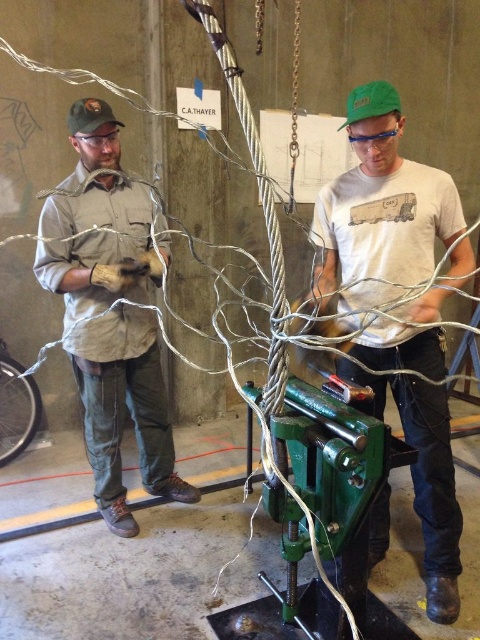
Between white matte t-shirt at center and matte khaki shirt at left, which one appears on the left side from the viewer's perspective?

matte khaki shirt at left is more to the left.

Who is lower down, white matte t-shirt at center or matte khaki shirt at left?

white matte t-shirt at center is lower down.

You are a GUI agent. You are given a task and a screenshot of the screen. Output one action in this format:
    pyautogui.click(x=<x>, y=<y>)
    Task: Click on the white matte t-shirt at center
    
    Given the screenshot: What is the action you would take?
    pyautogui.click(x=381, y=204)